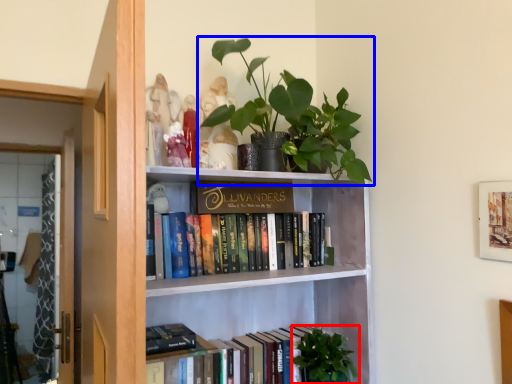
Question: Which object appears farthest to the camera in this image, vegetation (highlighted by a red box) or houseplant (highlighted by a blue box)?

Choices:
 (A) vegetation
 (B) houseplant

Answer: (A)